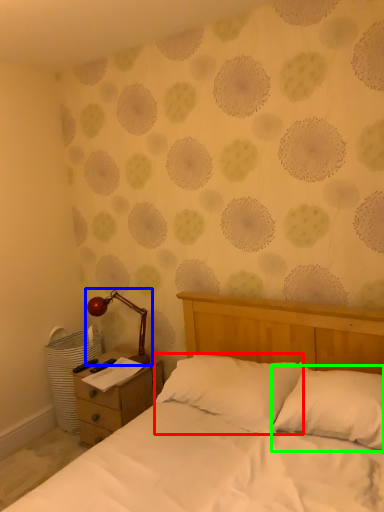
Question: Which is farther away from pillow (highlighted by a red box)? lamp (highlighted by a blue box) or pillow (highlighted by a green box)?

Choices:
 (A) lamp
 (B) pillow

Answer: (A)